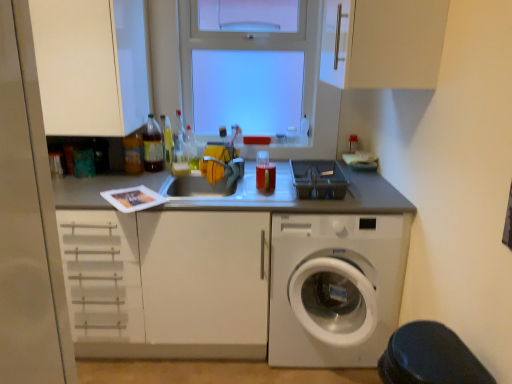
Question: Can you confirm if white plastic washing machine at lower right is smaller than black rubber step stool at lower right?

Choices:
 (A) no
 (B) yes

Answer: (A)

Question: From a real-world perspective, is white plastic washing machine at lower right located beneath black rubber step stool at lower right?

Choices:
 (A) yes
 (B) no

Answer: (A)

Question: Would you say black rubber step stool at lower right is part of white plastic washing machine at lower right's contents?

Choices:
 (A) yes
 (B) no

Answer: (B)

Question: Is white plastic washing machine at lower right with black rubber step stool at lower right?

Choices:
 (A) yes
 (B) no

Answer: (B)

Question: Is white plastic washing machine at lower right taller than black rubber step stool at lower right?

Choices:
 (A) no
 (B) yes

Answer: (B)

Question: From a real-world perspective, relative to black rubber step stool at lower right, is translucent plastic bottle at center, which is the 5th bottle from left to right, vertically above or below?

Choices:
 (A) above
 (B) below

Answer: (A)

Question: In terms of height, does translucent plastic bottle at center, which is the 5th bottle from left to right, look taller or shorter compared to black rubber step stool at lower right?

Choices:
 (A) short
 (B) tall

Answer: (A)

Question: Is translucent plastic bottle at center, the second bottle viewed from the right, bigger or smaller than black rubber step stool at lower right?

Choices:
 (A) big
 (B) small

Answer: (B)

Question: Does point (198, 163) appear closer or farther from the camera than point (437, 370)?

Choices:
 (A) farther
 (B) closer

Answer: (A)

Question: Is translucent plastic bottle at upper center, positioned as the third bottle in right-to-left order, situated inside white matte cabinet at upper center, which appears as the 3th cabinetry when viewed from the left, or outside?

Choices:
 (A) inside
 (B) outside

Answer: (B)

Question: In terms of size, does translucent plastic bottle at upper center, which appears as the fourth bottle when viewed from the left, appear bigger or smaller than white matte cabinet at upper center, which is counted as the first cabinetry, starting from the right?

Choices:
 (A) small
 (B) big

Answer: (A)

Question: In the image, is translucent plastic bottle at upper center, positioned as the third bottle in right-to-left order, positioned in front of or behind white matte cabinet at upper center, which appears as the 3th cabinetry when viewed from the left?

Choices:
 (A) behind
 (B) front

Answer: (A)

Question: From the image's perspective, is translucent plastic bottle at upper center, positioned as the third bottle in right-to-left order, above or below white matte cabinet at upper center, which appears as the 3th cabinetry when viewed from the left?

Choices:
 (A) above
 (B) below

Answer: (B)

Question: Choose the correct answer: Is transparent glass window at upper center inside white matte cabinet at upper center, which is counted as the first cabinetry, starting from the right, or outside it?

Choices:
 (A) outside
 (B) inside

Answer: (A)

Question: Is transparent glass window at upper center taller or shorter than white matte cabinet at upper center, which is counted as the first cabinetry, starting from the right?

Choices:
 (A) short
 (B) tall

Answer: (B)